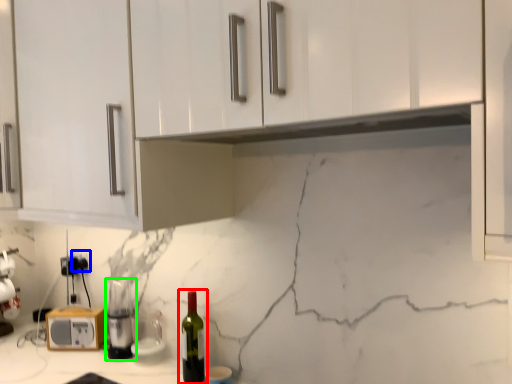
Question: Which is nearer to the bottle (highlighted by a red box)? electric outlet (highlighted by a blue box) or appliance (highlighted by a green box).

Choices:
 (A) electric outlet
 (B) appliance

Answer: (B)